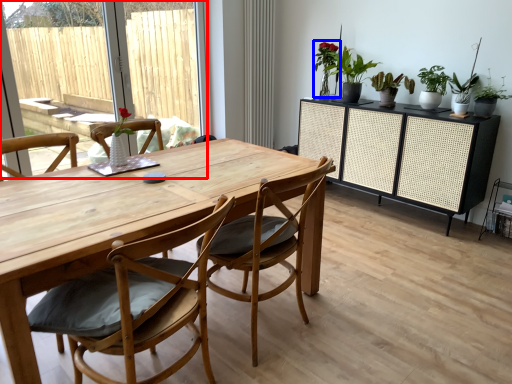
Question: Which of the following is the closest to the observer, window screen (highlighted by a red box) or plant (highlighted by a blue box)?

Choices:
 (A) window screen
 (B) plant

Answer: (A)